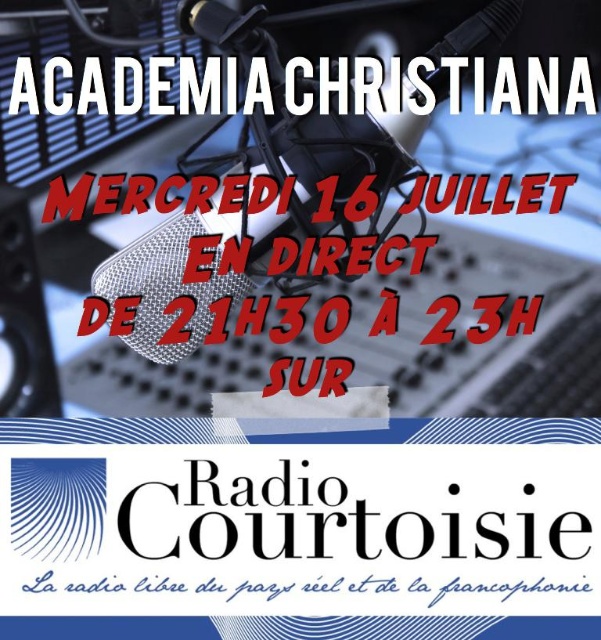
Looking at this image, you are a graphic designer reviewing the layout of this event poster. You notice two key points marked on the design. The first point is at coordinates point [409,92] and the second is at point [200,584]. Based on the spatial arrangement of the elements in the scene, which of these two points is closer to the foreground of the poster?

Point [409,92] is in front of point [200,584], so it is closer to the foreground of the poster.

You are designing a digital poster and want to place a new element exactly where the white metallic text at upper center is located. What are the coordinates of this position?

The coordinates of the white metallic text at upper center are at point (x=166, y=86).

You are designing a poster for an event and need to place a logo at the point marked by the coordinates point (166, 86). Based on the scene description, what object or element will the logo overlap with?

The point (166, 86) corresponds to white metallic text at upper center, so placing the logo there will overlap with the white metallic text at upper center.